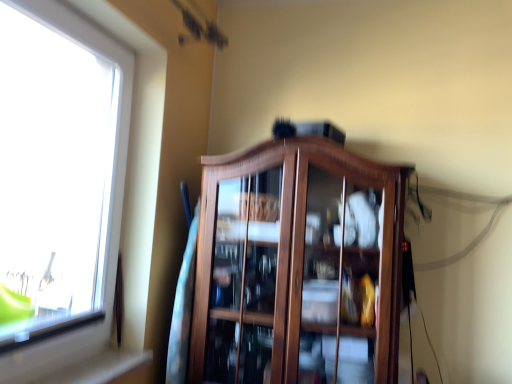
Question: From the image's perspective, is wooden cabinet at center positioned above or below transparent glass window at left?

Choices:
 (A) below
 (B) above

Answer: (A)

Question: Is point (207, 372) closer or farther from the camera than point (56, 251)?

Choices:
 (A) farther
 (B) closer

Answer: (B)

Question: In terms of size, does wooden cabinet at center appear bigger or smaller than transparent glass window at left?

Choices:
 (A) small
 (B) big

Answer: (B)

Question: From the image's perspective, is transparent glass window at left positioned above or below wooden cabinet at center?

Choices:
 (A) below
 (B) above

Answer: (B)

Question: From a real-world perspective, is transparent glass window at left positioned above or below wooden cabinet at center?

Choices:
 (A) below
 (B) above

Answer: (B)

Question: In terms of size, does transparent glass window at left appear bigger or smaller than wooden cabinet at center?

Choices:
 (A) small
 (B) big

Answer: (A)

Question: From their relative heights in the image, would you say transparent glass window at left is taller or shorter than wooden cabinet at center?

Choices:
 (A) tall
 (B) short

Answer: (A)